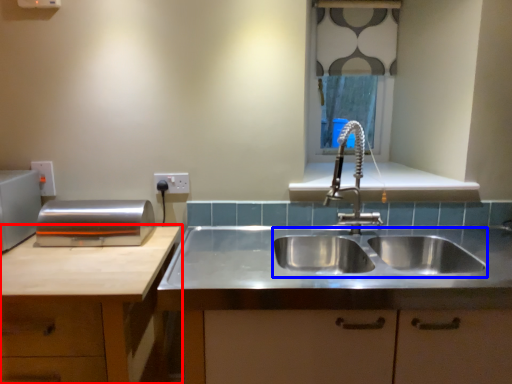
Question: Which of the following is the farthest to the observer, cabinetry (highlighted by a red box) or sink (highlighted by a blue box)?

Choices:
 (A) cabinetry
 (B) sink

Answer: (B)